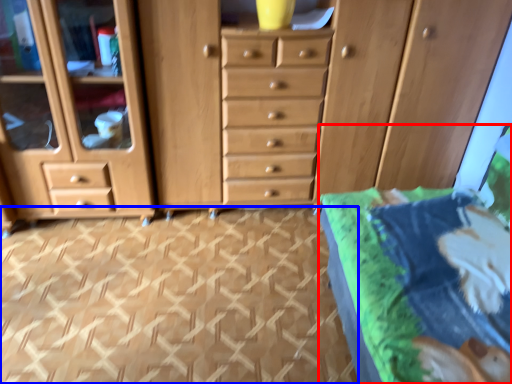
Question: Which object is closer to the camera taking this photo, bed (highlighted by a red box) or tile (highlighted by a blue box)?

Choices:
 (A) bed
 (B) tile

Answer: (A)